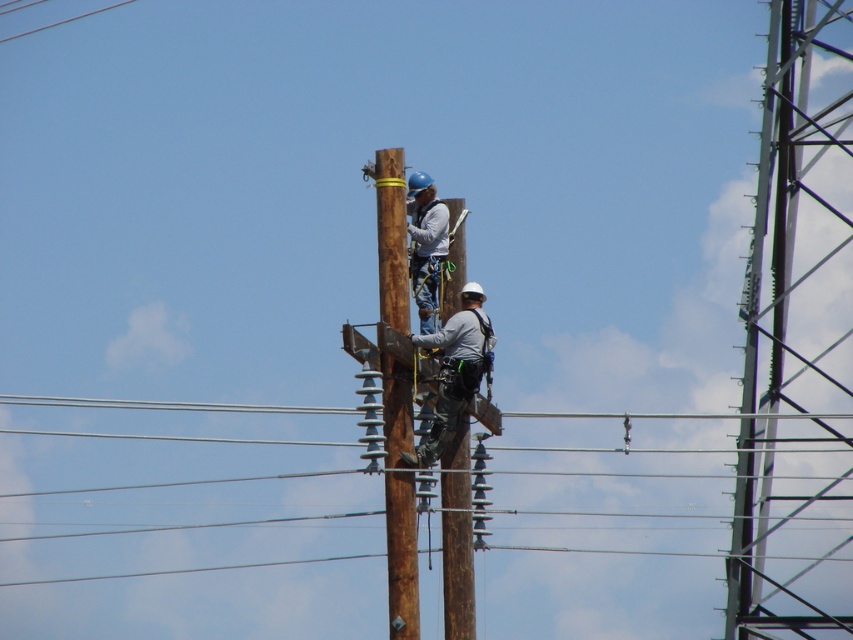
You are a safety inspector reviewing the image of two workers on a utility pole. You notice the brown wooden telegraph pole at center and the matte gray jacket at center. According to safety regulations, workers must always be above the equipment they are working on. Is the current positioning compliant with this rule?

The brown wooden telegraph pole at center is located below the matte gray jacket at center, meaning the worker wearing the matte gray jacket at center is positioned above the pole. This complies with the safety regulation requiring workers to be above the equipment they are working on.

You are a safety inspector reviewing the scene of two workers on a utility pole. You need to determine if the gray fabric construction worker at center is positioned higher than the clear blue wire at upper left. Based on the image, what is your assessment?

The gray fabric construction worker at center is taller than clear blue wire at upper left, so the worker is positioned higher than the wire.